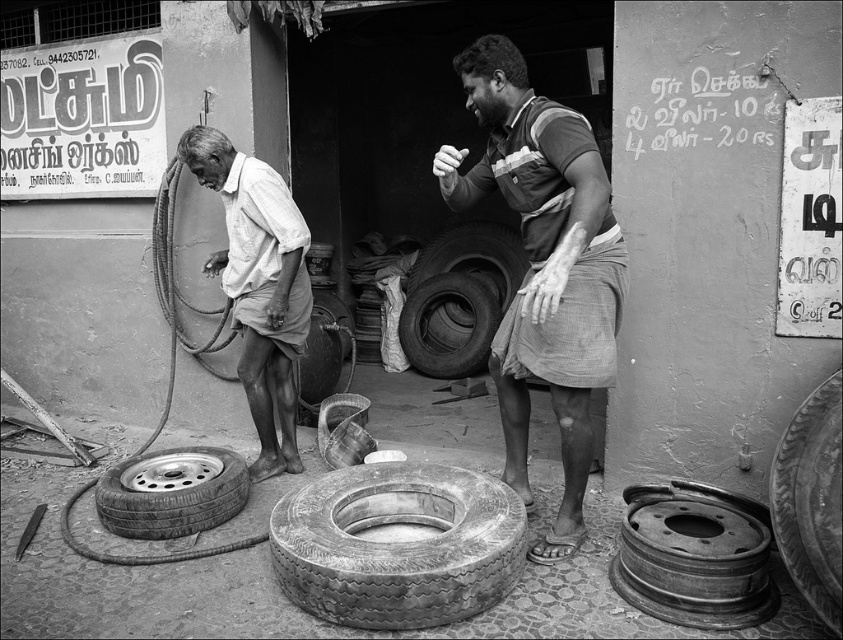
Question: Based on their relative distances, which object is farther from the matte white shirt at center?

Choices:
 (A) metallic rubber tire at lower left
 (B) rubber/tire at center
 (C) worn rubber tire at center

Answer: (B)

Question: Is matte gray shirt at center to the right of rubber/tire at center from the viewer's perspective?

Choices:
 (A) no
 (B) yes

Answer: (B)

Question: Which point appears closest to the camera in this image?

Choices:
 (A) (576, 525)
 (B) (497, 317)
 (C) (285, 464)

Answer: (A)

Question: Which point appears closest to the camera in this image?

Choices:
 (A) (517, 396)
 (B) (251, 333)

Answer: (A)

Question: Is matte gray shirt at center further to camera compared to rubber/tire at center?

Choices:
 (A) yes
 (B) no

Answer: (B)

Question: Does rubber/tire at center have a larger size compared to rubber tire at center?

Choices:
 (A) no
 (B) yes

Answer: (A)